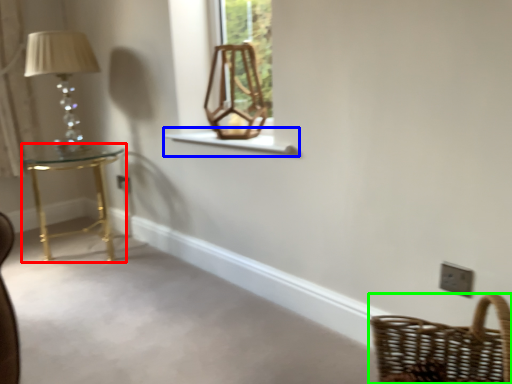
Question: Considering the real-world distances, which object is farthest from table (highlighted by a red box)? window sill (highlighted by a blue box) or basket (highlighted by a green box)?

Choices:
 (A) window sill
 (B) basket

Answer: (B)